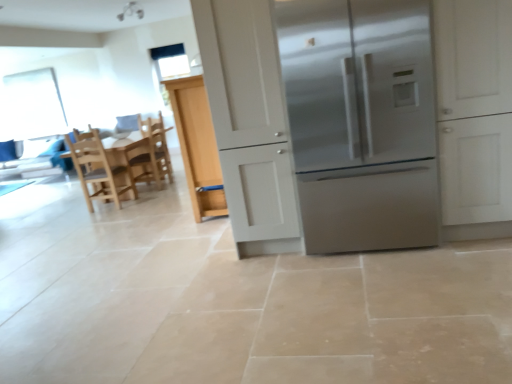
Question: Is light wood chair at left, which is the first chair in front-to-back order, next to clear glass window screen at upper center, which is counted as the first window screen, starting from the front, and touching it?

Choices:
 (A) yes
 (B) no

Answer: (B)

Question: From a real-world perspective, is light wood chair at left, which is the first chair in front-to-back order, below clear glass window screen at upper center, the 2th window screen positioned from the left?

Choices:
 (A) no
 (B) yes

Answer: (B)

Question: From the image's perspective, is light wood chair at left, the 2th chair positioned from the back, below clear glass window screen at upper center, which is counted as the second window screen, starting from the back?

Choices:
 (A) no
 (B) yes

Answer: (B)

Question: Is light wood chair at left, the 2th chair positioned from the back, positioned far away from clear glass window screen at upper center, the 2th window screen positioned from the left?

Choices:
 (A) no
 (B) yes

Answer: (B)

Question: Does light wood chair at left, the 2th chair positioned from the back, contain clear glass window screen at upper center, which is counted as the first window screen, starting from the front?

Choices:
 (A) no
 (B) yes

Answer: (A)

Question: Would you say clear glass window screen at upper center, the first window screen in the right-to-left sequence, is to the left or to the right of transparent plastic window screen at upper left, acting as the second window screen starting from the right, in the picture?

Choices:
 (A) right
 (B) left

Answer: (A)

Question: From the image's perspective, is clear glass window screen at upper center, which is counted as the second window screen, starting from the back, above or below transparent plastic window screen at upper left, the second window screen positioned from the front?

Choices:
 (A) above
 (B) below

Answer: (A)

Question: Looking at their shapes, would you say clear glass window screen at upper center, the first window screen in the right-to-left sequence, is wider or thinner than transparent plastic window screen at upper left, the second window screen positioned from the front?

Choices:
 (A) thin
 (B) wide

Answer: (B)

Question: In terms of size, does clear glass window screen at upper center, which is counted as the first window screen, starting from the front, appear bigger or smaller than transparent plastic window screen at upper left, acting as the second window screen starting from the right?

Choices:
 (A) big
 (B) small

Answer: (B)

Question: Based on their sizes in the image, would you say stainless steel refrigerator at center is bigger or smaller than transparent plastic window screen at upper left, the second window screen positioned from the front?

Choices:
 (A) small
 (B) big

Answer: (B)

Question: From the image's perspective, relative to transparent plastic window screen at upper left, acting as the second window screen starting from the right, is stainless steel refrigerator at center above or below?

Choices:
 (A) below
 (B) above

Answer: (A)

Question: Choose the correct answer: Is stainless steel refrigerator at center inside transparent plastic window screen at upper left, arranged as the 1th window screen when viewed from the back, or outside it?

Choices:
 (A) inside
 (B) outside

Answer: (B)

Question: Is point (303, 21) closer or farther from the camera than point (33, 132)?

Choices:
 (A) closer
 (B) farther

Answer: (A)

Question: In the image, is white matte cabinet at center positioned in front of or behind light wood chair at left, the 2th chair positioned from the back?

Choices:
 (A) front
 (B) behind

Answer: (A)

Question: Considering the positions of white matte cabinet at center and light wood chair at left, which is the first chair in front-to-back order, in the image, is white matte cabinet at center bigger or smaller than light wood chair at left, which is the first chair in front-to-back order,?

Choices:
 (A) big
 (B) small

Answer: (A)